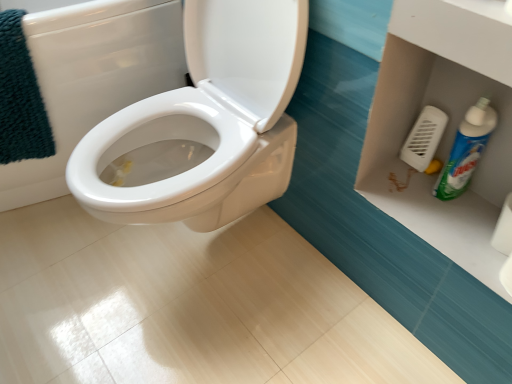
Question: Are white plastic vent at right and teal plush bath towel at upper left far apart?

Choices:
 (A) yes
 (B) no

Answer: (B)

Question: Is white plastic vent at right wider than teal plush bath towel at upper left?

Choices:
 (A) no
 (B) yes

Answer: (A)

Question: Is white plastic vent at right surrounding teal plush bath towel at upper left?

Choices:
 (A) no
 (B) yes

Answer: (A)

Question: From a real-world perspective, is white plastic vent at right located beneath teal plush bath towel at upper left?

Choices:
 (A) yes
 (B) no

Answer: (A)

Question: Is white plastic vent at right thinner than teal plush bath towel at upper left?

Choices:
 (A) yes
 (B) no

Answer: (A)

Question: From their relative heights in the image, would you say white plastic vent at right is taller or shorter than white glossy toilet at center?

Choices:
 (A) short
 (B) tall

Answer: (A)

Question: Relative to white glossy toilet at center, is white plastic vent at right in front or behind?

Choices:
 (A) behind
 (B) front

Answer: (A)

Question: Is white plastic vent at right spatially inside white glossy toilet at center, or outside of it?

Choices:
 (A) inside
 (B) outside

Answer: (B)

Question: From the image's perspective, relative to white glossy toilet at center, is white plastic vent at right above or below?

Choices:
 (A) below
 (B) above

Answer: (A)

Question: Considering the positions of point (424, 140) and point (443, 173), is point (424, 140) closer or farther from the camera than point (443, 173)?

Choices:
 (A) closer
 (B) farther

Answer: (B)

Question: Do you think white plastic vent at right is within green plastic bottle at lower right, or outside of it?

Choices:
 (A) outside
 (B) inside

Answer: (A)

Question: Considering the positions of white plastic vent at right and green plastic bottle at lower right in the image, is white plastic vent at right wider or thinner than green plastic bottle at lower right?

Choices:
 (A) thin
 (B) wide

Answer: (A)

Question: Looking at the image, does white plastic vent at right seem bigger or smaller compared to green plastic bottle at lower right?

Choices:
 (A) big
 (B) small

Answer: (B)

Question: Would you say teal plush bath towel at upper left is to the left or to the right of white glossy toilet at center in the picture?

Choices:
 (A) right
 (B) left

Answer: (A)

Question: Do you think teal plush bath towel at upper left is within white glossy toilet at center, or outside of it?

Choices:
 (A) inside
 (B) outside

Answer: (A)